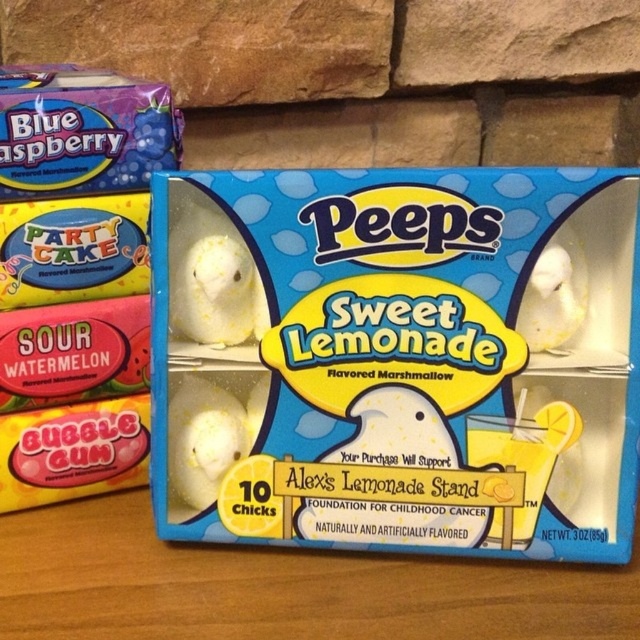
Question: Based on their relative distances, which object is farther from the white matte marshmallow chicks at center?

Choices:
 (A) matte plastic marshmallows at upper left
 (B) white matte chick at center

Answer: (A)

Question: Among these points, which one is nearest to the camera?

Choices:
 (A) (458, 390)
 (B) (552, 289)
 (C) (60, 276)

Answer: (B)

Question: Can you confirm if matte plastic marshmallows at upper left is positioned to the left of white matte chick at center?

Choices:
 (A) yes
 (B) no

Answer: (A)

Question: Among these objects, which one is nearest to the camera?

Choices:
 (A) matte plastic marshmallows at upper left
 (B) white matte chick at center

Answer: (B)

Question: Does white matte marshmallow chicks at center have a smaller size compared to white matte chick at center?

Choices:
 (A) yes
 (B) no

Answer: (B)

Question: Does matte plastic marshmallows at upper left have a smaller size compared to white matte chick at center?

Choices:
 (A) yes
 (B) no

Answer: (B)